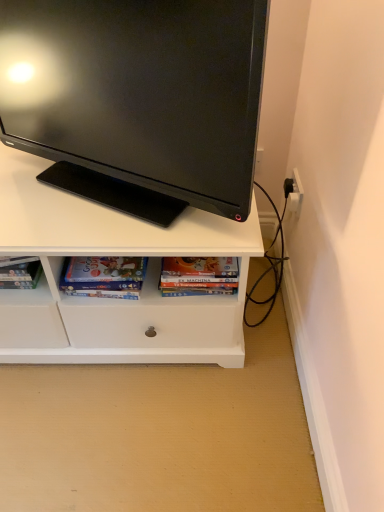
Question: Does matte black monitor at upper center appear on the right side of hardcover book at center, acting as the 1th book starting from the right?

Choices:
 (A) yes
 (B) no

Answer: (B)

Question: Is matte black monitor at upper center turned away from hardcover book at center, the second book positioned from the left?

Choices:
 (A) no
 (B) yes

Answer: (A)

Question: Is matte black monitor at upper center surrounding hardcover book at center, acting as the 1th book starting from the right?

Choices:
 (A) yes
 (B) no

Answer: (B)

Question: Can you confirm if matte black monitor at upper center is positioned to the left of hardcover book at center, acting as the 1th book starting from the right?

Choices:
 (A) no
 (B) yes

Answer: (B)

Question: Would you consider matte black monitor at upper center to be distant from hardcover book at center, the second book positioned from the left?

Choices:
 (A) no
 (B) yes

Answer: (A)

Question: Considering the positions of hardcover book at center, the second book positioned from the left, and matte black monitor at upper center in the image, is hardcover book at center, the second book positioned from the left, wider or thinner than matte black monitor at upper center?

Choices:
 (A) wide
 (B) thin

Answer: (B)

Question: Based on their positions, is hardcover book at center, acting as the 1th book starting from the right, located to the left or right of matte black monitor at upper center?

Choices:
 (A) left
 (B) right

Answer: (B)

Question: Which is correct: hardcover book at center, the second book positioned from the left, is inside matte black monitor at upper center, or outside of it?

Choices:
 (A) inside
 (B) outside

Answer: (B)

Question: Considering the positions of hardcover book at center, the second book positioned from the left, and matte black monitor at upper center in the image, is hardcover book at center, the second book positioned from the left, bigger or smaller than matte black monitor at upper center?

Choices:
 (A) small
 (B) big

Answer: (A)

Question: In terms of width, does hardcover book at center, the second book positioned from the left, look wider or thinner when compared to matte cardboard book at lower center, which is the second book from right to left?

Choices:
 (A) thin
 (B) wide

Answer: (A)

Question: Is hardcover book at center, the second book positioned from the left, inside or outside of matte cardboard book at lower center, the first book from the left?

Choices:
 (A) inside
 (B) outside

Answer: (B)

Question: In terms of size, does hardcover book at center, the second book positioned from the left, appear bigger or smaller than matte cardboard book at lower center, which is the second book from right to left?

Choices:
 (A) big
 (B) small

Answer: (B)

Question: Does point (236, 266) appear closer or farther from the camera than point (122, 289)?

Choices:
 (A) closer
 (B) farther

Answer: (A)

Question: In terms of height, does matte black monitor at upper center look taller or shorter compared to hardcover book at center, the second book positioned from the left?

Choices:
 (A) tall
 (B) short

Answer: (A)

Question: Is point (104, 185) positioned closer to the camera than point (173, 291)?

Choices:
 (A) closer
 (B) farther

Answer: (B)